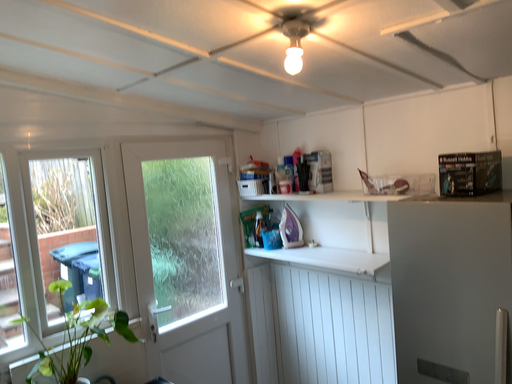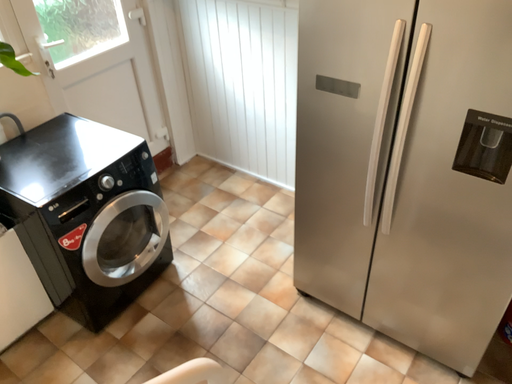
Question: Which way did the camera rotate in the video?

Choices:
 (A) rotated downward
 (B) rotated upward

Answer: (A)